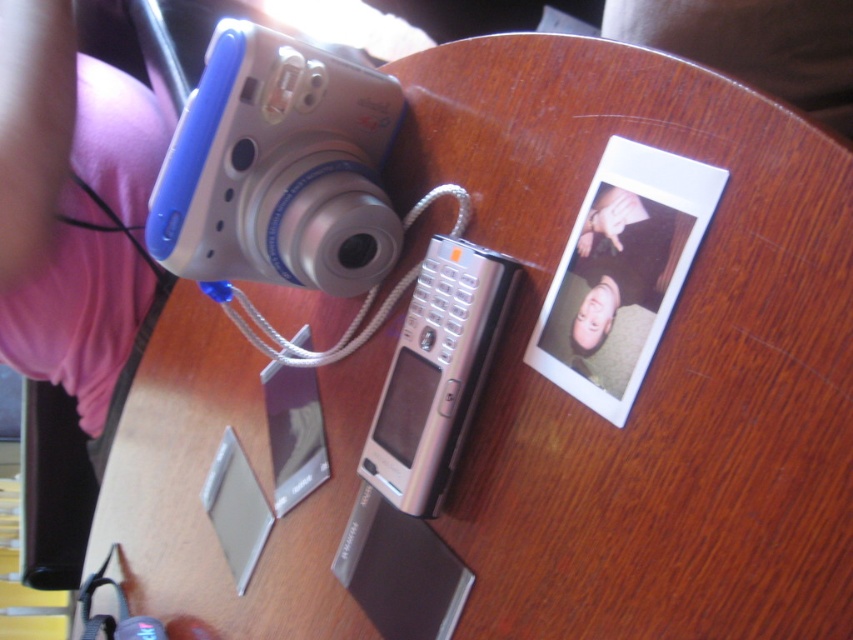
Is silver metallic phone at center shorter than matte silver phone at center?

No, silver metallic phone at center is not shorter than matte silver phone at center.

Does silver metallic phone at center appear on the right side of matte silver phone at center?

Incorrect, silver metallic phone at center is not on the right side of matte silver phone at center.

Does point (430, 288) lie behind point (585, 360)?

Yes, it is behind point (585, 360).

At what (x,y) coordinates should I click in order to perform the action: click on silver metallic phone at center. Please return your answer as a coordinate pair (x, y). The height and width of the screenshot is (640, 853). Looking at the image, I should click on (436, 372).

Can you confirm if blue plastic camera at upper left is positioned below silver metallic phone at center?

No.

Is blue plastic camera at upper left to the right of silver metallic phone at center from the viewer's perspective?

Incorrect, blue plastic camera at upper left is not on the right side of silver metallic phone at center.

Does point (239, 246) come in front of point (506, 292)?

No.

Image resolution: width=853 pixels, height=640 pixels. What are the coordinates of `blue plastic camera at upper left` in the screenshot? It's located at (277, 168).

Is point (222, 131) closer to camera compared to point (630, 192)?

That is False.

Is point (258, 230) positioned after point (627, 324)?

Yes, it is behind point (627, 324).

The image size is (853, 640). Identify the location of blue plastic camera at upper left. (277, 168).